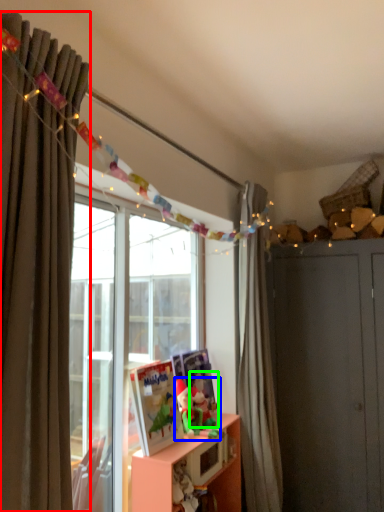
Question: Which object is positioned closest to curtain (highlighted by a red box)? Select from toy (highlighted by a blue box) and toy (highlighted by a green box).

Choices:
 (A) toy
 (B) toy

Answer: (A)